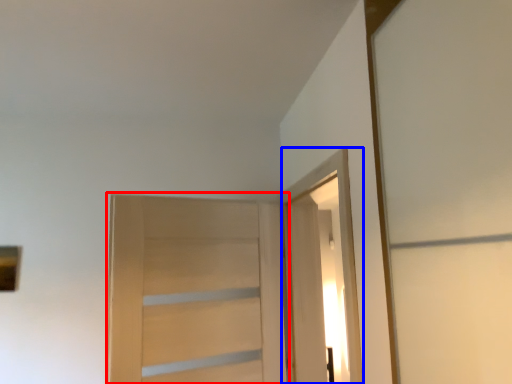
Question: Which of the following is the farthest to the observer, door (highlighted by a red box) or elevator (highlighted by a blue box)?

Choices:
 (A) door
 (B) elevator

Answer: (A)